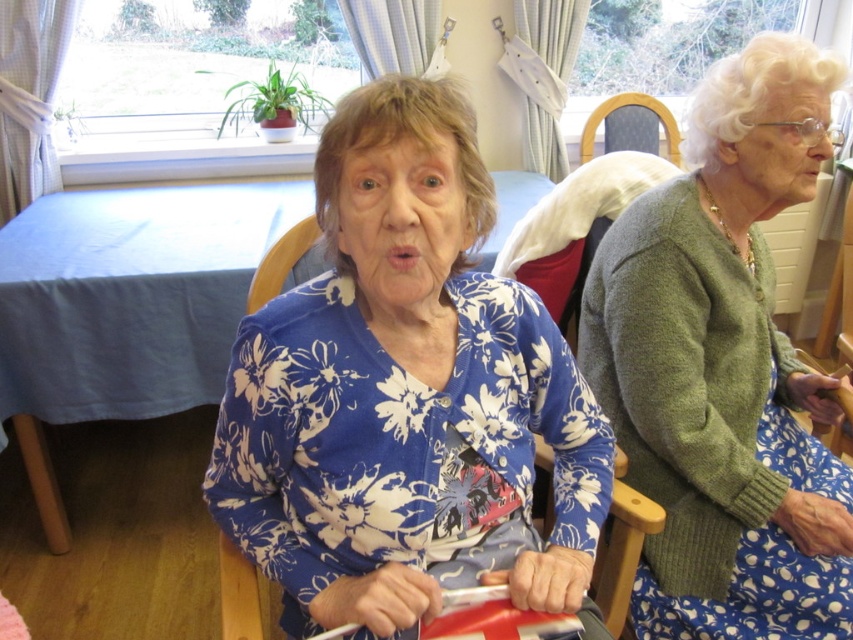
You are an interior designer planning to place a new sofa in the room. You see the blue floral cardigan at center and the dark brown leather chair at upper center. Which object takes up more space in the room?

The blue floral cardigan at center takes up more space in the room than the dark brown leather chair at upper center because it is bigger.

You are a nurse in this room and need to place a small medical kit between the two points, point [680,413] and point [608,97]. Which point should the medical kit be closer to in order to be closer to the woman in the foreground?

The medical kit should be closer to point [680,413] because it is in front of point [608,97], meaning it is closer to the woman in the foreground.

You are an interior designer assessing the placement of items in the room. The blue floral cardigan at center is at coordinates 0.619, 0.477. If you need to place a decorative item exactly 0.2 units to the right of its current position, what would be the new coordinates?

The new coordinates would be 0.619 plus 0.2 in the x direction, so (405,524).